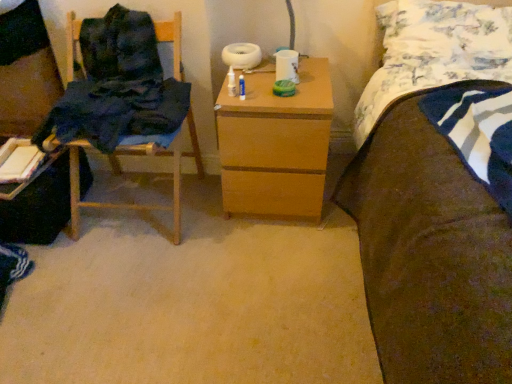
Find the location of a particular element. spots to the right of wooden chair at left is located at coordinates (220, 226).